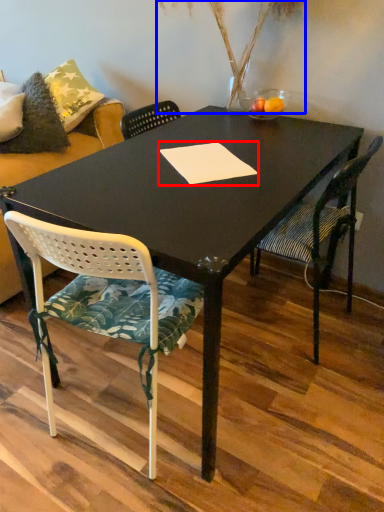
Question: Which object appears closest to the camera in this image, notepad (highlighted by a red box) or plant (highlighted by a blue box)?

Choices:
 (A) notepad
 (B) plant

Answer: (A)